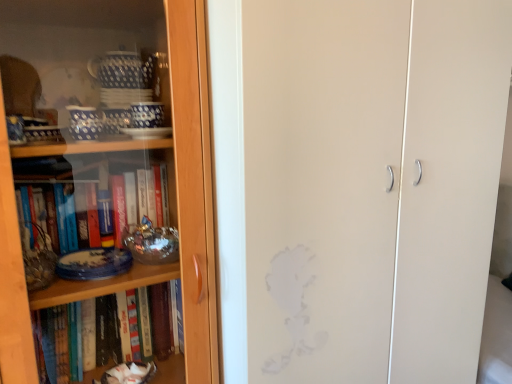
What are the coordinates of `wooden bookcase at left` in the screenshot? It's located at (106, 165).

What do you see at coordinates (106, 165) in the screenshot?
I see `wooden bookcase at left` at bounding box center [106, 165].

In order to face wooden bookcase at left, should I rotate leftwards or rightwards?

Rotate left and turn 20.383 degrees.

Locate an element on the screen. matte white cabinet at center is located at coordinates (371, 185).

What do you see at coordinates (371, 185) in the screenshot?
I see `matte white cabinet at center` at bounding box center [371, 185].

This screenshot has width=512, height=384. What are the coordinates of `wooden bookcase at left` in the screenshot? It's located at (106, 165).

Is wooden bookcase at left to the right of matte white cabinet at center from the viewer's perspective?

No.

Is wooden bookcase at left further to camera compared to matte white cabinet at center?

No.

Is point (172, 6) closer to viewer compared to point (393, 118)?

Yes, point (172, 6) is in front of point (393, 118).

From the image's perspective, would you say wooden bookcase at left is shown under matte white cabinet at center?

Incorrect, from the image's perspective, wooden bookcase at left is higher than matte white cabinet at center.

From a real-world perspective, between wooden bookcase at left and matte white cabinet at center, who is vertically higher?

wooden bookcase at left.

Which of these two, wooden bookcase at left or matte white cabinet at center, is thinner?

wooden bookcase at left is thinner.

In the scene shown: Is wooden bookcase at left taller or shorter than matte white cabinet at center?

Clearly, wooden bookcase at left is shorter compared to matte white cabinet at center.

Considering the sizes of objects wooden bookcase at left and matte white cabinet at center in the image provided, who is smaller, wooden bookcase at left or matte white cabinet at center?

Smaller between the two is wooden bookcase at left.

Is wooden bookcase at left surrounding matte white cabinet at center?

No.

Is wooden bookcase at left beside matte white cabinet at center?

No, wooden bookcase at left is not making contact with matte white cabinet at center.

Is wooden bookcase at left aimed at matte white cabinet at center?

No, wooden bookcase at left is not aimed at matte white cabinet at center.

What's the angular difference between wooden bookcase at left and matte white cabinet at center's facing directions?

The angle between the facing direction of wooden bookcase at left and the facing direction of matte white cabinet at center is 2.42 degrees.

Measure the distance between wooden bookcase at left and matte white cabinet at center.

They are 17.86 inches apart.

The height and width of the screenshot is (384, 512). I want to click on bookcase on the left of matte white cabinet at center, so click(106, 165).

Is matte white cabinet at center at the right side of wooden bookcase at left?

Yes.

Considering the relative positions of matte white cabinet at center and wooden bookcase at left in the image provided, is matte white cabinet at center behind wooden bookcase at left?

Yes, it is behind wooden bookcase at left.

Does point (428, 99) come behind point (170, 114)?

Yes, point (428, 99) is behind point (170, 114).

Consider the image. From the image's perspective, which object appears higher, matte white cabinet at center or wooden bookcase at left?

wooden bookcase at left appears higher in the image.

From a real-world perspective, is matte white cabinet at center on wooden bookcase at left?

Incorrect, from a real-world perspective, matte white cabinet at center is lower than wooden bookcase at left.

Considering the sizes of objects matte white cabinet at center and wooden bookcase at left in the image provided, who is wider, matte white cabinet at center or wooden bookcase at left?

matte white cabinet at center.

Is matte white cabinet at center taller than wooden bookcase at left?

Indeed, matte white cabinet at center has a greater height compared to wooden bookcase at left.

Does matte white cabinet at center have a smaller size compared to wooden bookcase at left?

No, matte white cabinet at center is not smaller than wooden bookcase at left.

Is matte white cabinet at center inside the boundaries of wooden bookcase at left, or outside?

matte white cabinet at center is not inside wooden bookcase at left, it's outside.

Looking at this image, would you consider matte white cabinet at center to be distant from wooden bookcase at left?

That's not correct — matte white cabinet at center is a little close to wooden bookcase at left.

Is matte white cabinet at center positioned with its back to wooden bookcase at left?

No.

How much distance is there between matte white cabinet at center and wooden bookcase at left?

A distance of 17.86 inches exists between matte white cabinet at center and wooden bookcase at left.

Find the location of `bookcase located above the matte white cabinet at center (from the image's perspective)`. bookcase located above the matte white cabinet at center (from the image's perspective) is located at coordinates (106, 165).

Find the location of a particular element. screen door behind the wooden bookcase at left is located at coordinates (371, 185).

This screenshot has width=512, height=384. I want to click on bookcase located above the matte white cabinet at center (from a real-world perspective), so click(106, 165).